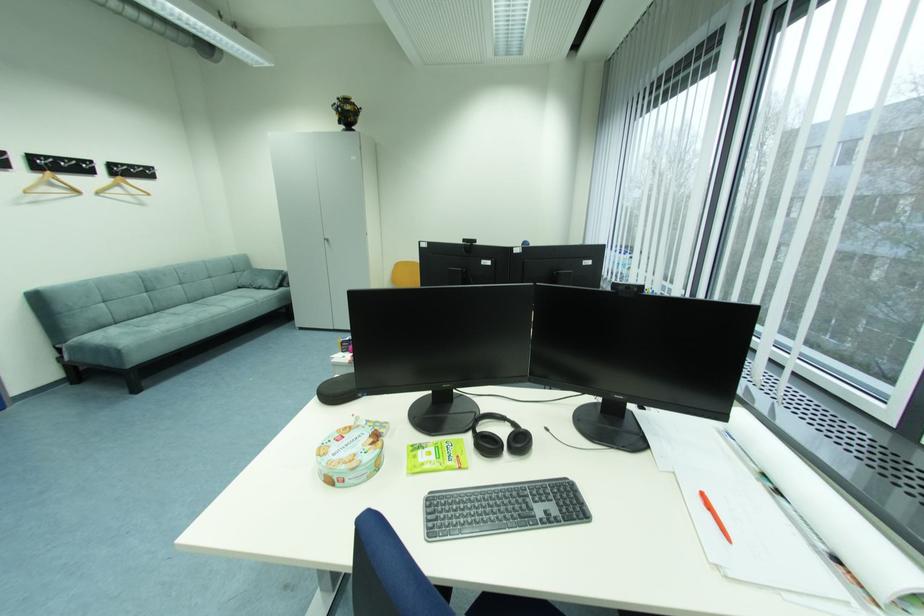
Where is `orange pen`? This screenshot has height=616, width=924. orange pen is located at coordinates (714, 516).